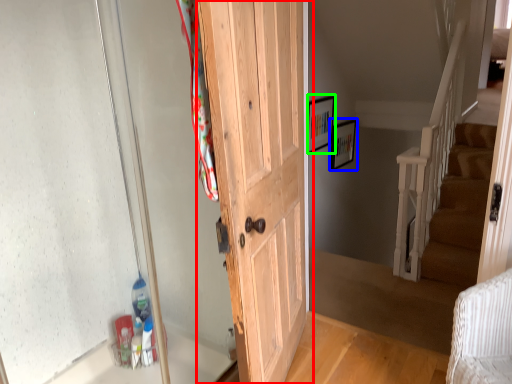
Question: Considering the real-world distances, which object is farthest from door (highlighted by a red box)? picture frame (highlighted by a blue box) or picture frame (highlighted by a green box)?

Choices:
 (A) picture frame
 (B) picture frame

Answer: (A)